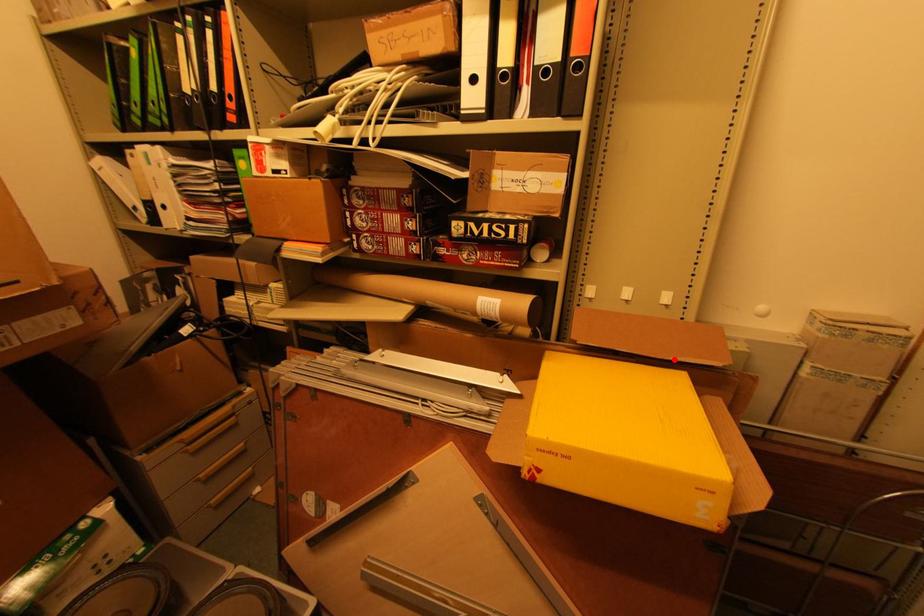
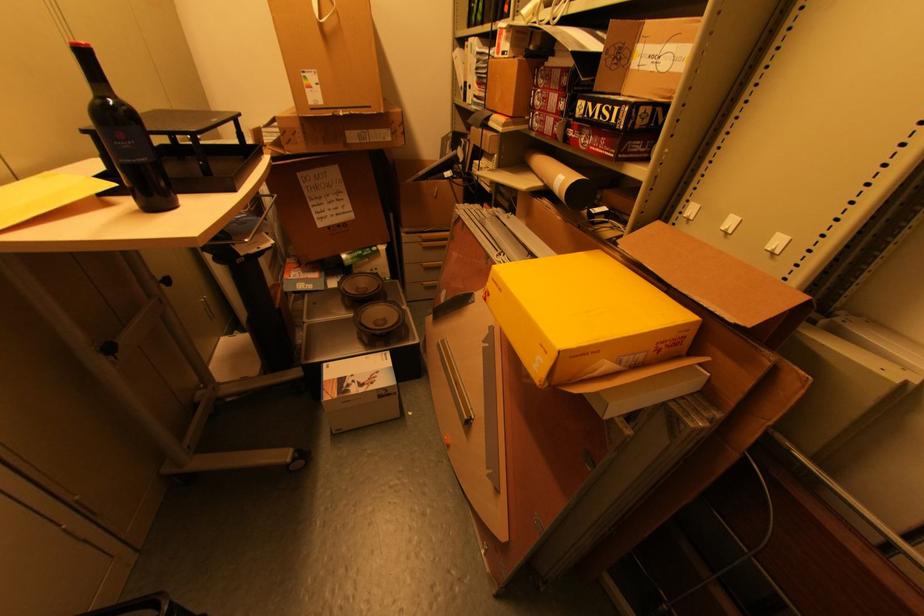
The point at the highlighted location is marked in the first image. Where is the corresponding point in the second image?

(688, 294)